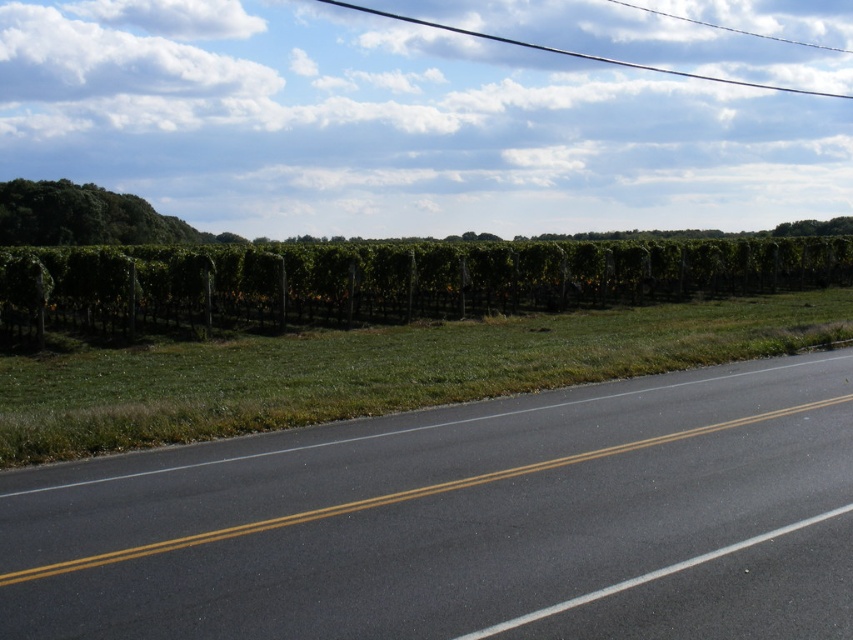
You are driving on the two lane road and see the green leafy hedge at upper center and the green leafy tree at upper left in the distance. Which one is positioned more to the right side of the road?

The green leafy hedge at upper center is positioned more to the right side of the road compared to the green leafy tree at upper left.

Looking at this image, you are driving on the black asphalt highway at center and notice a green leafy tree at upper right in your rearview mirror. Which object will appear smaller in your mirror as you continue driving?

The black asphalt highway at center will appear smaller in the mirror than the green leafy tree at upper right because it is smaller in actual size compared to the tree.

You are driving on the black asphalt highway at center and notice a green leafy tree at upper right. Which object is closer to the driver?

The black asphalt highway at center is positioned under the green leafy tree at upper right, so the highway is closer to the driver than the tree.